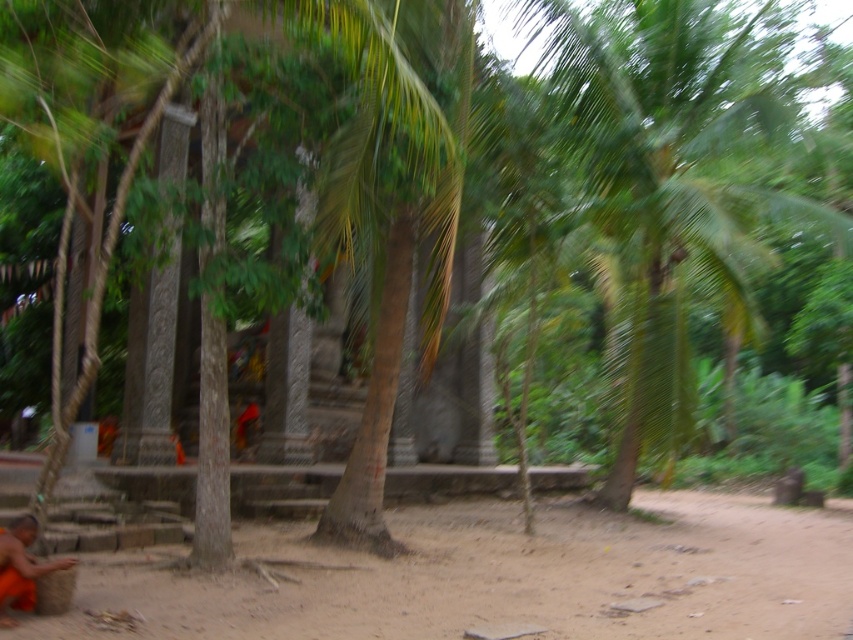
You are a photographer trying to capture the monk in the scene. To get the best shot, you need to position yourself so that the brown sandy dirt at lower center is directly below your camera lens. Where should you aim your camera relative to the monk?

The brown sandy dirt at lower center is located at point [503,577], so you should aim your camera slightly to the right and lower than the monk to ensure the dirt is directly below the lens.

You are a photographer trying to capture the brown sandy dirt at lower center and the green leafy palm tree at right in a single frame. Based on their positions, which object would appear closer to the camera in the photo?

The brown sandy dirt at lower center appears closer to the camera because it is positioned in front of the green leafy palm tree at right.

You are a photographer trying to capture the orange cloth at lower left and the green leafy palm tree at right in the same frame. Which object should you adjust your camera focus on to ensure the other remains in the background?

You should focus on the green leafy palm tree at right because it is closer to the viewer than the orange cloth at lower left, so adjusting focus on it will keep the orange cloth at lower left in the background.